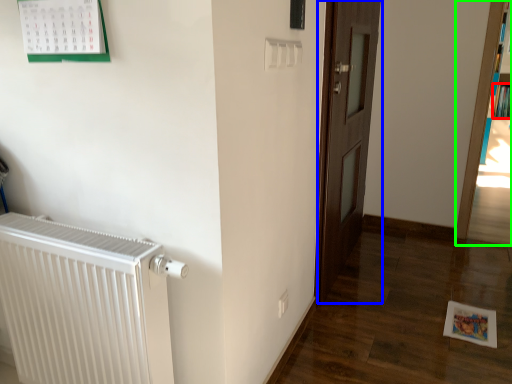
Question: Which is nearer to the book (highlighted by a red box)? door (highlighted by a blue box) or bookcase (highlighted by a green box).

Choices:
 (A) door
 (B) bookcase

Answer: (B)